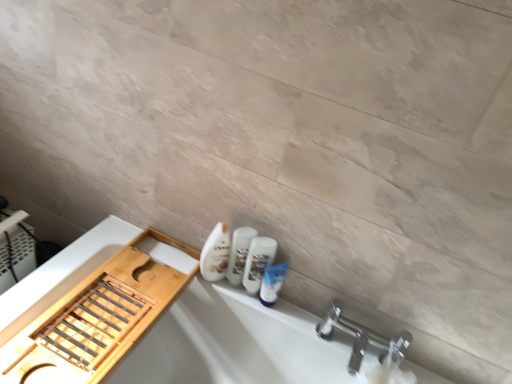
Describe the element at coordinates (215, 253) in the screenshot. I see `white glossy bottle at center` at that location.

I want to click on white glossy bottle at center, so click(x=215, y=253).

Looking at this image, how much space does white glossy mouthwash at lower right, which appears as the 2th mouthwash when viewed from the left, occupy vertically?

The height of white glossy mouthwash at lower right, which appears as the 2th mouthwash when viewed from the left, is 8.27 inches.

Image resolution: width=512 pixels, height=384 pixels. Identify the location of white glossy bottle at center. (215, 253).

Is white glossy mouthwash at lower right, which is counted as the 1th mouthwash, starting from the right, closer to camera compared to white glossy mouthwash at lower center, which is the 1th mouthwash from left to right?

Yes.

Consider the image. Is white glossy mouthwash at lower center, positioned as the second mouthwash in right-to-left order, at the back of white glossy mouthwash at lower right, which appears as the 2th mouthwash when viewed from the left?

No, white glossy mouthwash at lower right, which appears as the 2th mouthwash when viewed from the left,'s orientation is not away from white glossy mouthwash at lower center, positioned as the second mouthwash in right-to-left order.

From the image's perspective, is white glossy mouthwash at lower right, which appears as the 2th mouthwash when viewed from the left, above or below white glossy mouthwash at lower center, positioned as the second mouthwash in right-to-left order?

white glossy mouthwash at lower right, which appears as the 2th mouthwash when viewed from the left, is below white glossy mouthwash at lower center, positioned as the second mouthwash in right-to-left order.

Based on the photo, does white glossy mouthwash at lower right, which is counted as the 1th mouthwash, starting from the right, touch white glossy mouthwash at lower center, positioned as the second mouthwash in right-to-left order?

Yes, white glossy mouthwash at lower right, which is counted as the 1th mouthwash, starting from the right, is in contact with white glossy mouthwash at lower center, positioned as the second mouthwash in right-to-left order.

Is point (270, 256) farther from camera compared to point (387, 356)?

Yes, it is behind point (387, 356).

Who is shorter, white glossy mouthwash at lower right, which is counted as the 1th mouthwash, starting from the right, or chrome metallic faucet at lower right?

Standing shorter between the two is chrome metallic faucet at lower right.

Which of these two, white glossy mouthwash at lower right, which is counted as the 1th mouthwash, starting from the right, or chrome metallic faucet at lower right, is wider?

chrome metallic faucet at lower right.

Is white glossy mouthwash at lower right, which appears as the 2th mouthwash when viewed from the left, not within chrome metallic faucet at lower right?

Yes.

Which of these two, white glossy mouthwash at lower center, positioned as the second mouthwash in right-to-left order, or chrome metallic faucet at lower right, is wider?

With larger width is chrome metallic faucet at lower right.

Where is `the 2nd mouthwash to the left when counting from the chrome metallic faucet at lower right`? This screenshot has width=512, height=384. the 2nd mouthwash to the left when counting from the chrome metallic faucet at lower right is located at coordinates (x=239, y=253).

Between white glossy mouthwash at lower center, positioned as the second mouthwash in right-to-left order, and chrome metallic faucet at lower right, which one appears on the left side from the viewer's perspective?

From the viewer's perspective, white glossy mouthwash at lower center, positioned as the second mouthwash in right-to-left order, appears more on the left side.

From a real-world perspective, relative to chrome metallic faucet at lower right, is white matte bathtub at lower left vertically above or below?

white matte bathtub at lower left is situated lower than chrome metallic faucet at lower right in the real world.

From the image's perspective, does white matte bathtub at lower left appear lower than chrome metallic faucet at lower right?

Yes, from the image's perspective, white matte bathtub at lower left is below chrome metallic faucet at lower right.

Considering the positions of objects white matte bathtub at lower left and chrome metallic faucet at lower right in the image provided, who is in front, white matte bathtub at lower left or chrome metallic faucet at lower right?

white matte bathtub at lower left is more forward.

Is chrome metallic faucet at lower right at the back of white matte bathtub at lower left?

That's not correct — white matte bathtub at lower left is not looking away from chrome metallic faucet at lower right.

Looking at the image, does white glossy mouthwash at lower right, which is counted as the 1th mouthwash, starting from the right, seem bigger or smaller compared to white glossy bottle at center?

In the image, white glossy mouthwash at lower right, which is counted as the 1th mouthwash, starting from the right, appears to be smaller than white glossy bottle at center.

Locate an element on the screen. The width and height of the screenshot is (512, 384). toiletry on the left of white glossy mouthwash at lower right, which is counted as the 1th mouthwash, starting from the right is located at coordinates (215, 253).

Can you see white glossy mouthwash at lower right, which appears as the 2th mouthwash when viewed from the left, touching white glossy bottle at center?

Yes, white glossy mouthwash at lower right, which appears as the 2th mouthwash when viewed from the left, and white glossy bottle at center clearly make contact.

Which object is positioned more to the left, white glossy bottle at center or chrome metallic faucet at lower right?

white glossy bottle at center is more to the left.

Is white glossy bottle at center shorter than chrome metallic faucet at lower right?

No.

From a real-world perspective, between white glossy bottle at center and chrome metallic faucet at lower right, who is vertically higher?

From a 3D spatial view, white glossy bottle at center is above.

From the image's perspective, count 2nd mouthwashs upward from the white matte bathtub at lower left and point to it. Please provide its 2D coordinates.

[(239, 253)]

From their relative heights in the image, would you say white matte bathtub at lower left is taller or shorter than white glossy mouthwash at lower center, which is the 1th mouthwash from left to right?

white matte bathtub at lower left is taller than white glossy mouthwash at lower center, which is the 1th mouthwash from left to right.

How distant is white matte bathtub at lower left from white glossy mouthwash at lower center, positioned as the second mouthwash in right-to-left order?

white matte bathtub at lower left and white glossy mouthwash at lower center, positioned as the second mouthwash in right-to-left order, are 11.32 inches apart from each other.

Based on their positions, is white matte bathtub at lower left located to the left or right of white glossy mouthwash at lower center, which is the 1th mouthwash from left to right?

Based on their positions, white matte bathtub at lower left is located to the left of white glossy mouthwash at lower center, which is the 1th mouthwash from left to right.

Find the location of `mouthwash positioned vertically above the white glossy mouthwash at lower right, which appears as the 2th mouthwash when viewed from the left (from a real-world perspective)`. mouthwash positioned vertically above the white glossy mouthwash at lower right, which appears as the 2th mouthwash when viewed from the left (from a real-world perspective) is located at coordinates (239, 253).

Identify the location of tap on the right of white glossy mouthwash at lower right, which appears as the 2th mouthwash when viewed from the left. (362, 338).

Considering their positions, is white glossy mouthwash at lower right, which appears as the 2th mouthwash when viewed from the left, positioned closer to chrome metallic faucet at lower right than white glossy bottle at center?

white glossy mouthwash at lower right, which appears as the 2th mouthwash when viewed from the left, is closer to chrome metallic faucet at lower right.

Based on their spatial positions, is white glossy mouthwash at lower right, which appears as the 2th mouthwash when viewed from the left, or white matte bathtub at lower left further from white glossy bottle at center?

white matte bathtub at lower left.

Estimate the real-world distances between objects in this image. Which object is closer to white glossy mouthwash at lower right, which is counted as the 1th mouthwash, starting from the right, white glossy bottle at center or chrome metallic faucet at lower right?

white glossy bottle at center.

Estimate the real-world distances between objects in this image. Which object is closer to white glossy mouthwash at lower right, which is counted as the 1th mouthwash, starting from the right, white glossy mouthwash at lower center, positioned as the second mouthwash in right-to-left order, or white matte bathtub at lower left?

Among the two, white glossy mouthwash at lower center, positioned as the second mouthwash in right-to-left order, is located nearer to white glossy mouthwash at lower right, which is counted as the 1th mouthwash, starting from the right.

Considering their positions, is white glossy bottle at center positioned further to chrome metallic faucet at lower right than white glossy mouthwash at lower right, which appears as the 2th mouthwash when viewed from the left?

white glossy bottle at center is further to chrome metallic faucet at lower right.

From the picture: Looking at the image, which one is located closer to white matte bathtub at lower left, white glossy bottle at center or white glossy mouthwash at lower right, which is counted as the 1th mouthwash, starting from the right?

Based on the image, white glossy bottle at center appears to be nearer to white matte bathtub at lower left.

From the image, which object appears to be nearer to white glossy bottle at center, chrome metallic faucet at lower right or white glossy mouthwash at lower right, which appears as the 2th mouthwash when viewed from the left?

white glossy mouthwash at lower right, which appears as the 2th mouthwash when viewed from the left.

Based on their spatial positions, is chrome metallic faucet at lower right or white glossy mouthwash at lower right, which appears as the 2th mouthwash when viewed from the left, closer to white matte bathtub at lower left?

white glossy mouthwash at lower right, which appears as the 2th mouthwash when viewed from the left, is positioned closer to the anchor white matte bathtub at lower left.

You are a GUI agent. You are given a task and a screenshot of the screen. Output one action in this format:
    pyautogui.click(x=<x>, y=<y>)
    Task: Click on the mouthwash situated between white glossy bottle at center and white glossy mouthwash at lower right, which appears as the 2th mouthwash when viewed from the left, from left to right
    The width and height of the screenshot is (512, 384).
    Given the screenshot: What is the action you would take?
    pyautogui.click(x=239, y=253)

Find the location of a particular element. tap between white matte bathtub at lower left and white glossy mouthwash at lower right, which appears as the 2th mouthwash when viewed from the left, from front to back is located at coordinates (362, 338).

This screenshot has width=512, height=384. What are the coordinates of `mouthwash situated between white glossy mouthwash at lower center, positioned as the second mouthwash in right-to-left order, and chrome metallic faucet at lower right from left to right` in the screenshot? It's located at point(258,262).

At what (x,y) coordinates should I click in order to perform the action: click on tap that lies between white glossy mouthwash at lower center, positioned as the second mouthwash in right-to-left order, and white matte bathtub at lower left from top to bottom. Please return your answer as a coordinate pair (x, y). This screenshot has width=512, height=384. Looking at the image, I should click on (362, 338).